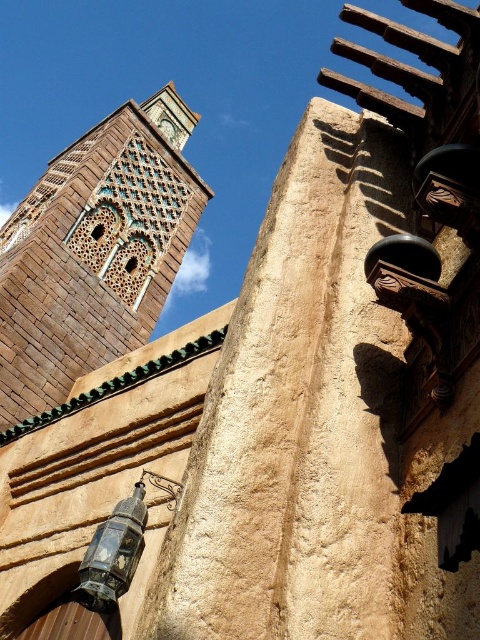
Question: Does brown textured stone tower at upper left lie behind matte black lantern at lower left?

Choices:
 (A) no
 (B) yes

Answer: (B)

Question: Which point is closer to the camera taking this photo?

Choices:
 (A) (33, 403)
 (B) (164, 484)
 (C) (165, 120)

Answer: (B)

Question: Is the position of brown textured stone tower at upper left more distant than that of green stone clock at upper center?

Choices:
 (A) yes
 (B) no

Answer: (B)

Question: Does brown textured stone tower at upper left appear over green stone clock at upper center?

Choices:
 (A) yes
 (B) no

Answer: (B)

Question: Among these points, which one is farthest from the camera?

Choices:
 (A) (79, 596)
 (B) (175, 134)

Answer: (B)

Question: Which is farther from the matte black lantern at lower left?

Choices:
 (A) green stone clock at upper center
 (B) brown textured stone tower at upper left

Answer: (A)